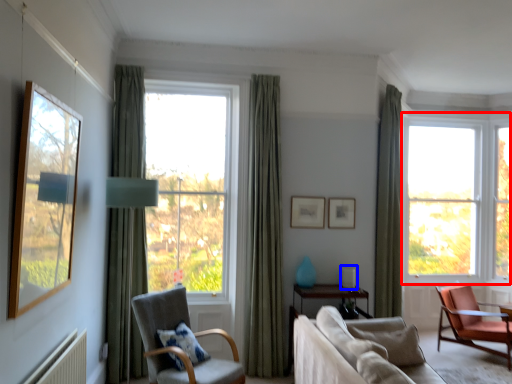
Question: Which point is closer to the camera, window (highlighted by a red box) or table lamp (highlighted by a blue box)?

Choices:
 (A) window
 (B) table lamp

Answer: (B)